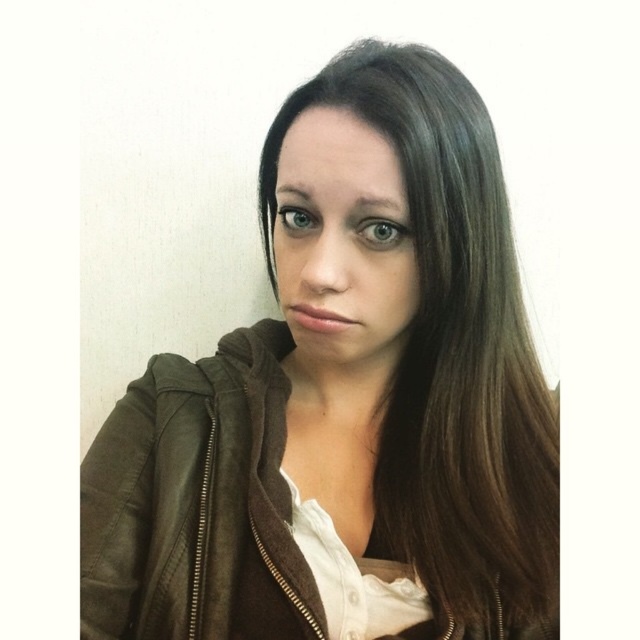
Between leather jacket at center and matte brown hair at center, which one has less height?

matte brown hair at center

This screenshot has height=640, width=640. Identify the location of leather jacket at center. (346, 401).

Image resolution: width=640 pixels, height=640 pixels. Identify the location of leather jacket at center. (346, 401).